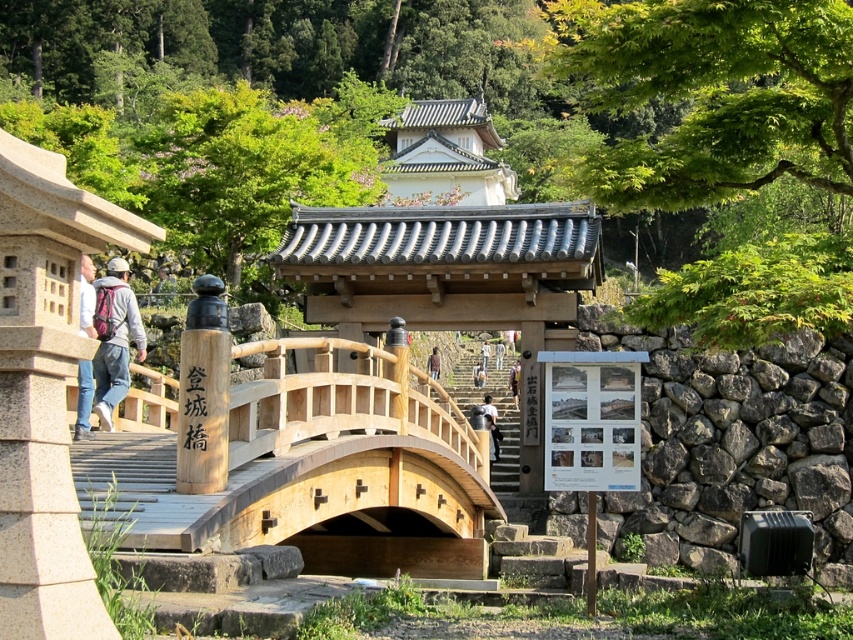
Is dark blue jeans at center in front of white cotton shirt at center?

Yes, it is in front of white cotton shirt at center.

Based on the photo, does dark blue jeans at center have a lesser width compared to white cotton shirt at center?

No, dark blue jeans at center is not thinner than white cotton shirt at center.

Measure the distance between dark blue jeans at center and camera.

They are 41.32 meters apart.

Locate an element on the screen. The image size is (853, 640). dark blue jeans at center is located at coordinates (491, 428).

You are a GUI agent. You are given a task and a screenshot of the screen. Output one action in this format:
    pyautogui.click(x=<x>, y=<y>)
    Task: Click on the brown leather jacket at center
    This screenshot has height=640, width=853.
    Given the screenshot: What is the action you would take?
    pyautogui.click(x=433, y=364)

Looking at this image, between brown leather jacket at center and white cotton shirt at center, which one has more height?

Standing taller between the two is white cotton shirt at center.

The image size is (853, 640). What do you see at coordinates (433, 364) in the screenshot?
I see `brown leather jacket at center` at bounding box center [433, 364].

Find the location of a particular element. This screenshot has height=640, width=853. brown leather jacket at center is located at coordinates (433, 364).

Does denim jacket at left appear on the left side of white cotton shirt at center?

Yes, denim jacket at left is to the left of white cotton shirt at center.

Who is more distant from viewer, (x=90, y=433) or (x=488, y=355)?

The point (x=488, y=355) is behind.

At what (x,y) coordinates should I click in order to perform the action: click on denim jacket at left. Please return your answer as a coordinate pair (x, y). Image resolution: width=853 pixels, height=640 pixels. Looking at the image, I should click on (83, 401).